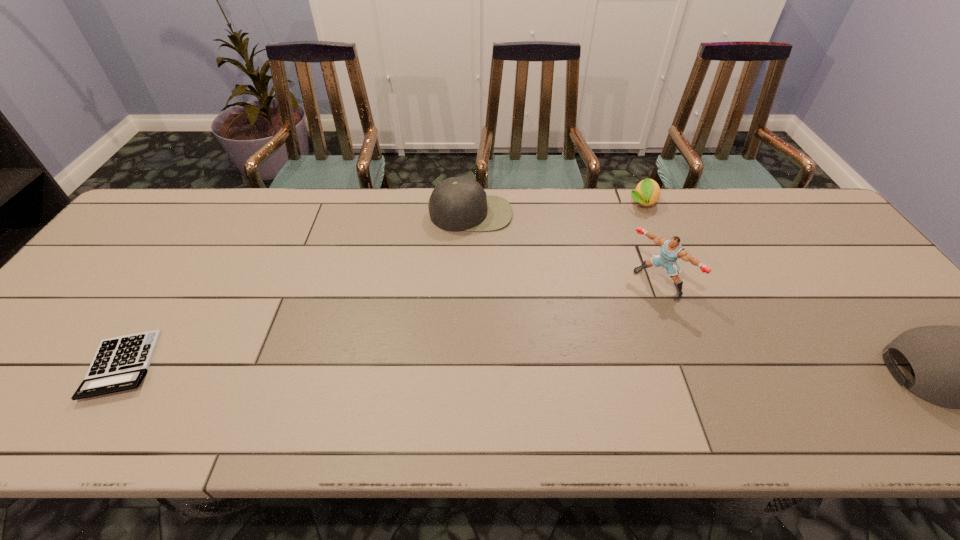
Where is `vacant area situated 0.190m with leaves positioned above the fourth tallest object`? The height and width of the screenshot is (540, 960). vacant area situated 0.190m with leaves positioned above the fourth tallest object is located at coordinates (642, 255).

The width and height of the screenshot is (960, 540). What are the coordinates of `free space located with leaves positioned above the fourth tallest object` in the screenshot? It's located at click(642, 246).

Image resolution: width=960 pixels, height=540 pixels. Find the location of `vacant space located with leaves positioned above the fourth tallest object`. vacant space located with leaves positioned above the fourth tallest object is located at coordinates (642, 268).

Locate an element on the screen. Image resolution: width=960 pixels, height=540 pixels. vacant space located 0.230m on the brim of the cap is located at coordinates (477, 289).

Where is `free space located 0.160m on the brim of the cap`? This screenshot has width=960, height=540. free space located 0.160m on the brim of the cap is located at coordinates (475, 271).

Find the location of `vacant region located on the brim of the cap`. vacant region located on the brim of the cap is located at coordinates (478, 307).

Where is `lemon located in the far edge section of the desktop`? lemon located in the far edge section of the desktop is located at coordinates (647, 192).

At what (x,y) coordinates should I click in order to perform the action: click on cap present at the far edge. Please return your answer as a coordinate pair (x, y). The image size is (960, 540). Looking at the image, I should click on (457, 203).

Locate an element on the screen. This screenshot has width=960, height=540. object present at the near edge is located at coordinates [120, 363].

You are a GUI agent. You are given a task and a screenshot of the screen. Output one action in this format:
    pyautogui.click(x=<x>, y=<y>)
    Task: Click on the object that is positioned at the left edge
    Image resolution: width=960 pixels, height=540 pixels.
    Given the screenshot: What is the action you would take?
    pyautogui.click(x=120, y=363)